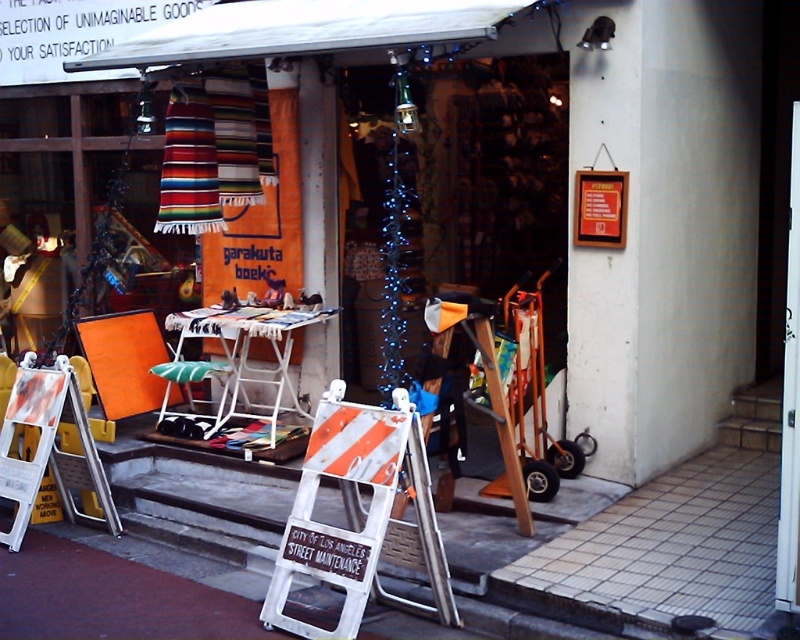
Question: Which point is farther to the camera?

Choices:
 (A) (396, 458)
 (B) (562, 106)

Answer: (B)

Question: Considering the relative positions of matte black sign at center and white plastic ladder at center in the image provided, where is matte black sign at center located with respect to white plastic ladder at center?

Choices:
 (A) left
 (B) right

Answer: (B)

Question: Among these points, which one is farthest from the camera?

Choices:
 (A) (440, 180)
 (B) (362, 612)

Answer: (A)

Question: Can you confirm if matte black sign at center is positioned below white plastic ladder at center?

Choices:
 (A) no
 (B) yes

Answer: (A)

Question: Can you confirm if matte black sign at center is positioned to the right of white plastic ladder at center?

Choices:
 (A) no
 (B) yes

Answer: (B)